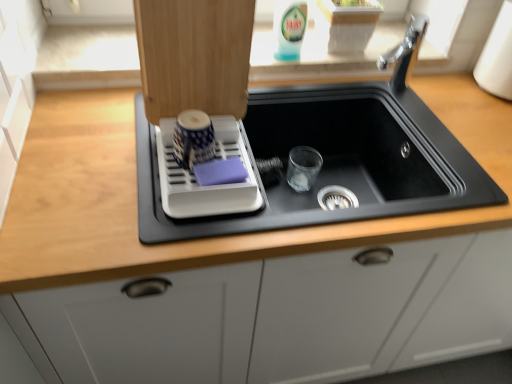
Question: From the image's perspective, is black matte sink at center on top of translucent plastic bottle at upper center?

Choices:
 (A) no
 (B) yes

Answer: (A)

Question: From a real-world perspective, is black matte sink at center below translucent plastic bottle at upper center?

Choices:
 (A) yes
 (B) no

Answer: (A)

Question: Are black matte sink at center and translucent plastic bottle at upper center making contact?

Choices:
 (A) yes
 (B) no

Answer: (B)

Question: Can you confirm if black matte sink at center is wider than translucent plastic bottle at upper center?

Choices:
 (A) yes
 (B) no

Answer: (A)

Question: Is black matte sink at center not near translucent plastic bottle at upper center?

Choices:
 (A) no
 (B) yes

Answer: (A)

Question: Is black matte sink at center shorter than translucent plastic bottle at upper center?

Choices:
 (A) no
 (B) yes

Answer: (A)

Question: Considering the relative sizes of black matte sink at center and white plastic dish rack at upper left in the image provided, is black matte sink at center smaller than white plastic dish rack at upper left?

Choices:
 (A) no
 (B) yes

Answer: (A)

Question: Considering the relative sizes of black matte sink at center and white plastic dish rack at upper left in the image provided, is black matte sink at center taller than white plastic dish rack at upper left?

Choices:
 (A) yes
 (B) no

Answer: (A)

Question: From a real-world perspective, does black matte sink at center sit lower than white plastic dish rack at upper left?

Choices:
 (A) yes
 (B) no

Answer: (A)

Question: Is black matte sink at center surrounding white plastic dish rack at upper left?

Choices:
 (A) yes
 (B) no

Answer: (B)

Question: Does black matte sink at center have a lesser height compared to white plastic dish rack at upper left?

Choices:
 (A) no
 (B) yes

Answer: (A)

Question: Considering the relative sizes of black matte sink at center and white plastic dish rack at upper left in the image provided, is black matte sink at center wider than white plastic dish rack at upper left?

Choices:
 (A) yes
 (B) no

Answer: (A)

Question: Can we say white plastic dish rack at upper left lies outside black matte sink at center?

Choices:
 (A) no
 (B) yes

Answer: (B)